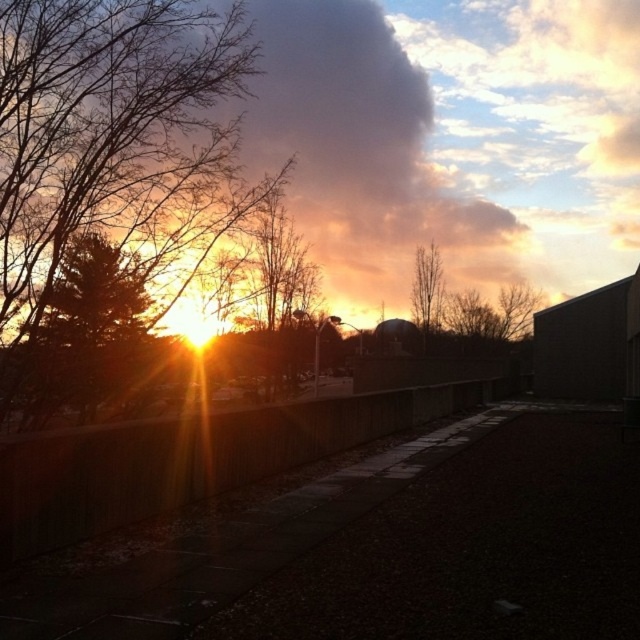
Question: Among these objects, which one is farthest from the camera?

Choices:
 (A) orange-brown bark tree at center
 (B) bare wood tree at upper center
 (C) brown leafless branches at left
 (D) green matte tree at left

Answer: (B)

Question: Which point is farther to the camera?

Choices:
 (A) (3, 204)
 (B) (257, 241)
 (C) (120, 368)
 (D) (435, 284)

Answer: (D)

Question: Is brown leafless branches at left closer to camera compared to green matte tree at left?

Choices:
 (A) no
 (B) yes

Answer: (A)

Question: Is brown leafless branches at left to the right of orange-brown bark tree at center from the viewer's perspective?

Choices:
 (A) yes
 (B) no

Answer: (B)

Question: Which point is closer to the camera?

Choices:
 (A) brown leafless branches at left
 (B) orange-brown bark tree at center

Answer: (A)

Question: Can you confirm if green matte tree at left is bigger than orange-brown bark tree at center?

Choices:
 (A) no
 (B) yes

Answer: (A)